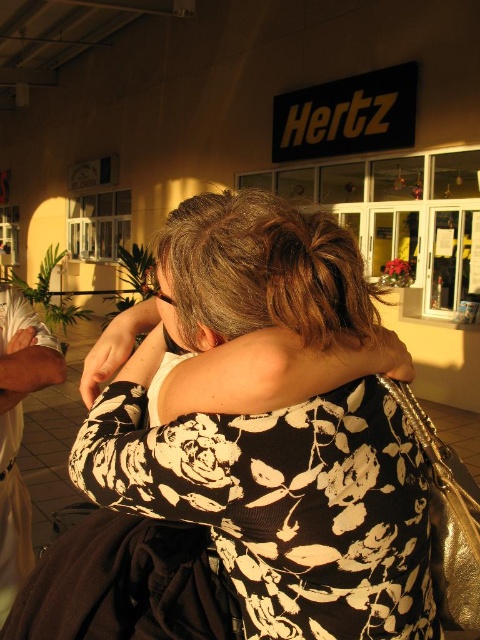
You are a photographer trying to capture the perfect shot of the black floral dress at center. You want to position your camera at point 0.5, 0.5. What direction should you move your camera to align it with the dress?

The black floral dress at center is located at point [274,435]. To align your camera at [240,320] with the dress, you should move your camera to the right and slightly upward since the dress is positioned to the right and slightly above the center point.

You are a photographer who wants to capture the black floral dress at center and the white fabric at left in a single frame. Based on their positions, can you tell me which object is higher in the image?

The black floral dress at center is above white fabric at left, so the black floral dress at center is higher in the image.

In the scene described, you notice a black floral dress at center and a white fabric at left. Which object is positioned to the right of the other?

The black floral dress at center is positioned to the right of the white fabric at left.